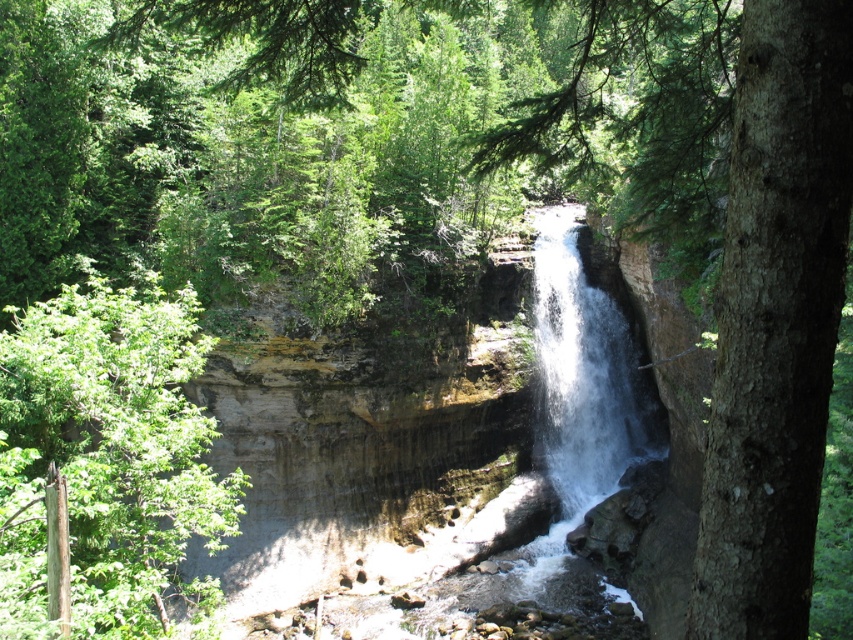
Is green rough bark tree at center right to the right of green leafy tree at center from the viewer's perspective?

Yes, green rough bark tree at center right is to the right of green leafy tree at center.

Does point (842, 8) lie behind point (196, 413)?

No, (842, 8) is closer to viewer.

I want to click on green rough bark tree at center right, so click(x=730, y=248).

You are a GUI agent. You are given a task and a screenshot of the screen. Output one action in this format:
    pyautogui.click(x=<x>, y=<y>)
    Task: Click on the green rough bark tree at center right
    This screenshot has width=853, height=640.
    Given the screenshot: What is the action you would take?
    pyautogui.click(x=730, y=248)

Who is taller, green leafy tree at center or white frothy water at center?

Standing taller between the two is white frothy water at center.

Who is more distant from viewer, (170, 365) or (660, 449)?

Point (660, 449)

The width and height of the screenshot is (853, 640). Describe the element at coordinates (109, 460) in the screenshot. I see `green leafy tree at center` at that location.

This screenshot has width=853, height=640. Identify the location of green leafy tree at center. (x=109, y=460).

Who is higher up, green rough bark tree at center right or white frothy water at center?

green rough bark tree at center right

Who is more distant from viewer, [770,577] or [573,212]?

Point [573,212]

Where is `green rough bark tree at center right`? The width and height of the screenshot is (853, 640). green rough bark tree at center right is located at coordinates (730, 248).